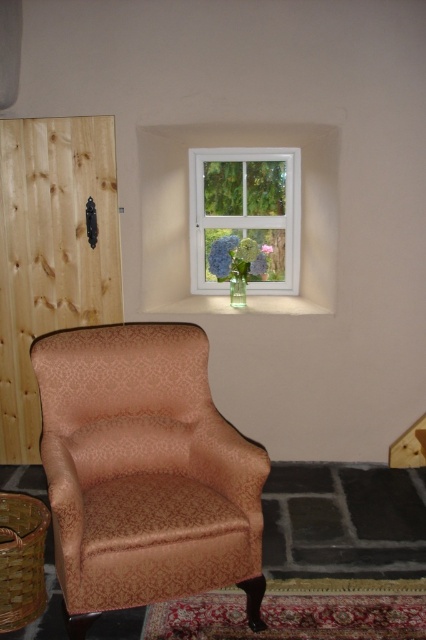
This screenshot has height=640, width=426. Describe the element at coordinates (238, 257) in the screenshot. I see `hydrangea bouquet at center` at that location.

Which is above, hydrangea bouquet at center or green matte flower at window?

green matte flower at window is higher up.

Which is in front, point (261, 259) or point (239, 243)?

Point (239, 243) is more forward.

Identify the location of hydrangea bouquet at center. (238, 257).

Does hydrangea bouquet at center appear on the right side of purple matte flower at center?

Yes, hydrangea bouquet at center is to the right of purple matte flower at center.

Can you confirm if hydrangea bouquet at center is positioned below purple matte flower at center?

Correct, hydrangea bouquet at center is located below purple matte flower at center.

Between point (224, 256) and point (212, 246), which one is positioned in front?

Positioned in front is point (224, 256).

Where is `hydrangea bouquet at center`? Image resolution: width=426 pixels, height=640 pixels. hydrangea bouquet at center is located at coordinates (238, 257).

Who is positioned more to the left, clear glass window at upper center or purple matte flower at center?

Positioned to the left is purple matte flower at center.

Who is more distant from viewer, [299,252] or [232,253]?

Positioned behind is point [299,252].

The height and width of the screenshot is (640, 426). What do you see at coordinates (244, 218) in the screenshot?
I see `clear glass window at upper center` at bounding box center [244, 218].

Locate an element on the screen. This screenshot has width=426, height=640. clear glass window at upper center is located at coordinates (244, 218).